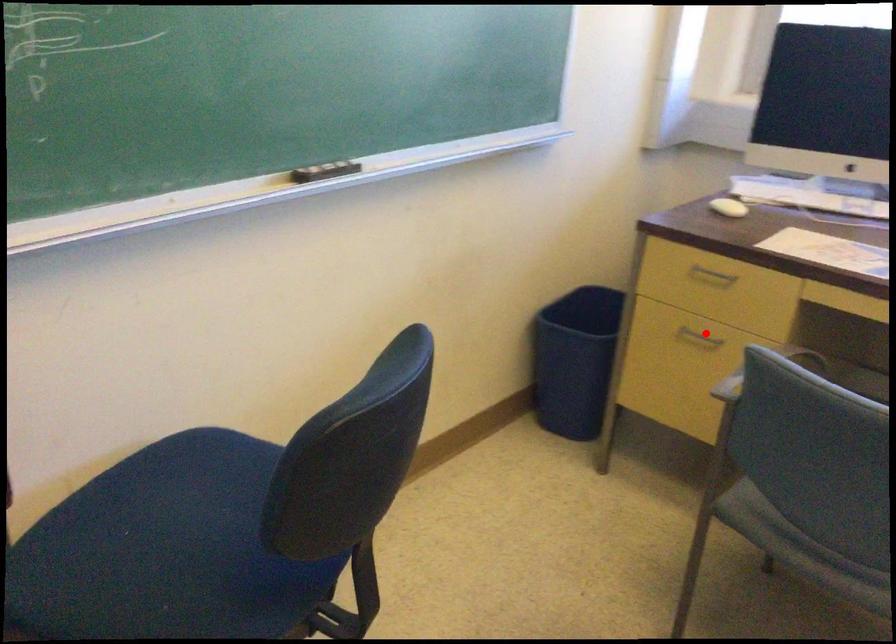
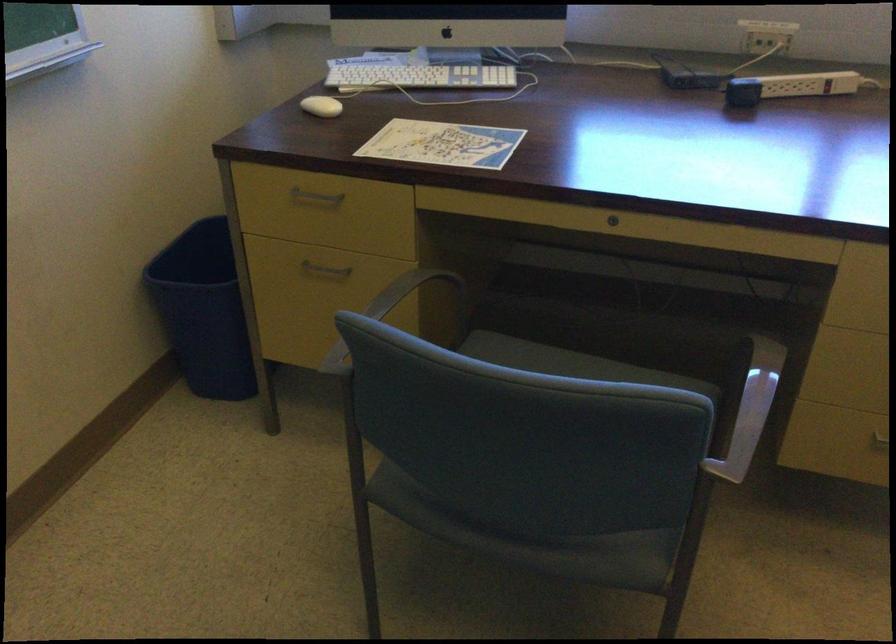
Question: I am providing you with two images of the same scene from different viewpoints. Given a red point in image1, look at the same physical point in image2. Is it:

Choices:
 (A) Closer to the viewpoint
 (B) Farther from the viewpoint

Answer: (A)